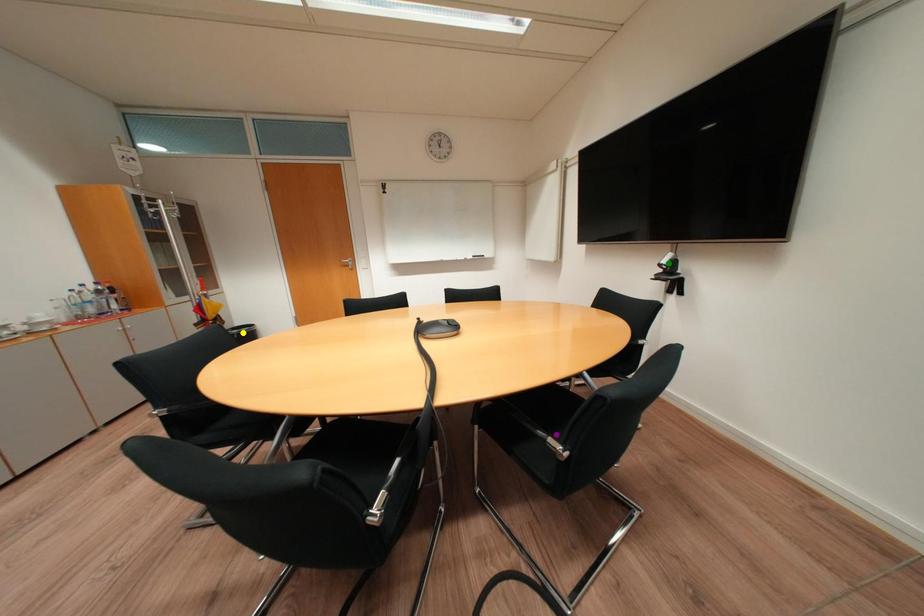
Order these from nearest to farthest:
yellow point
green point
purple point

purple point < green point < yellow point